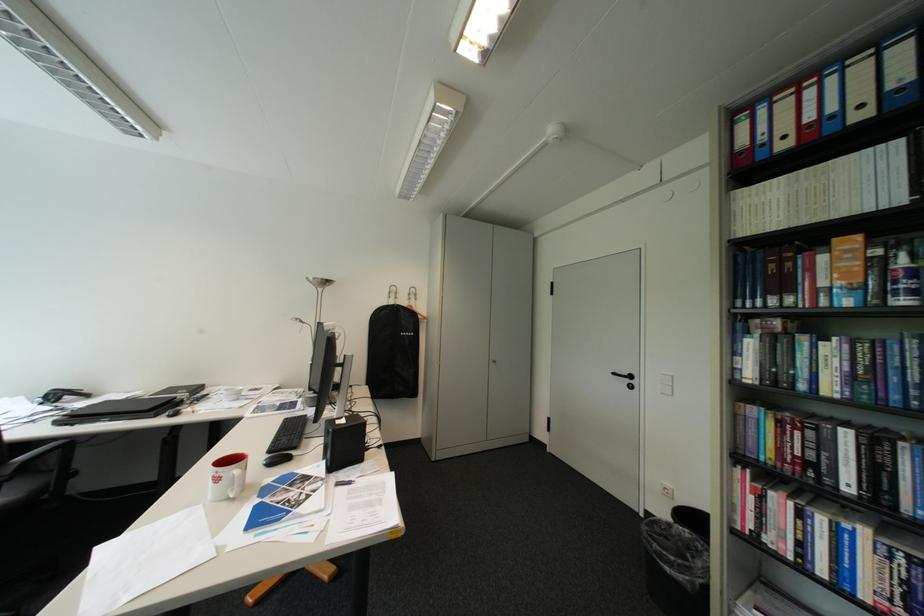
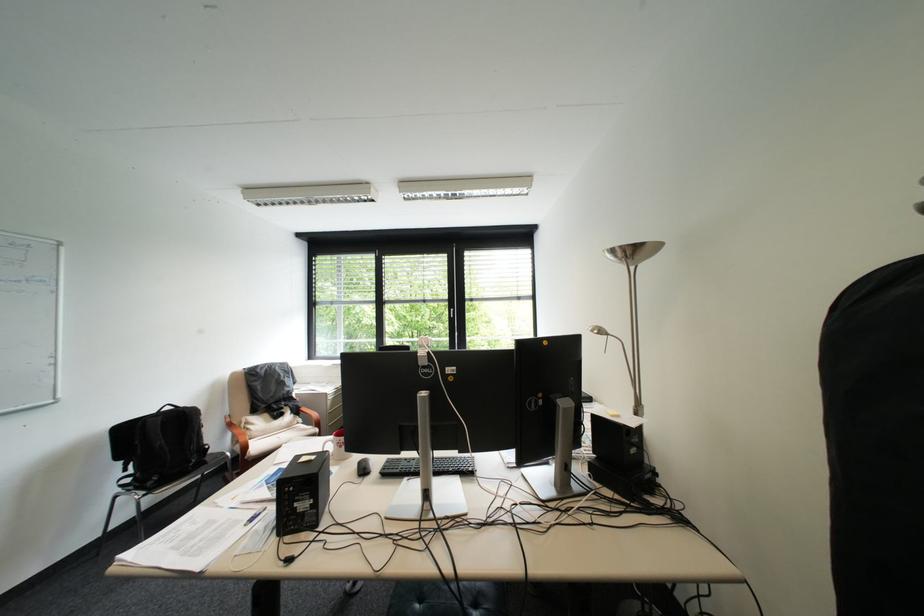
Find the pixel in the second image that matches [326,278] in the first image.

(625, 252)